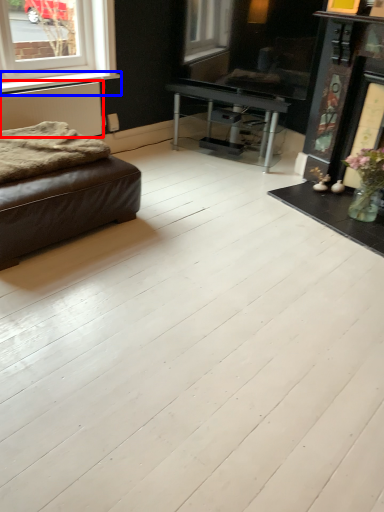
Question: Which object is closer to the camera taking this photo, radiator (highlighted by a red box) or window sill (highlighted by a blue box)?

Choices:
 (A) radiator
 (B) window sill

Answer: (A)